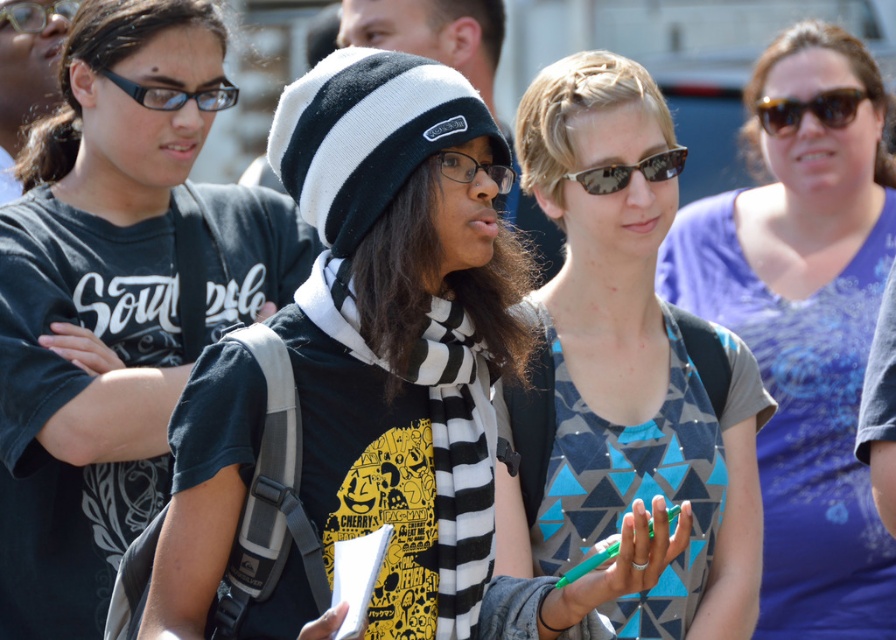
Which of these two, geometric-patterned shirt at center or clear plastic goggles at upper left, stands shorter?

clear plastic goggles at upper left is shorter.

Based on the photo, can you confirm if geometric-patterned shirt at center is shorter than clear plastic goggles at upper left?

No, geometric-patterned shirt at center is not shorter than clear plastic goggles at upper left.

Measure the distance between point [629,200] and camera.

Point [629,200] is 6.16 meters from camera.

Identify the location of geometric-patterned shirt at center. (627, 371).

Between matte black t-shirt at center and clear plastic goggles at upper left, which one has more height?

matte black t-shirt at center

Between point (116, 224) and point (48, 12), which one is positioned behind?

Positioned behind is point (48, 12).

Image resolution: width=896 pixels, height=640 pixels. I want to click on matte black t-shirt at center, so click(x=95, y=308).

Does camouflage-patterned sunglasses at center appear on the right side of clear plastic goggles at upper left?

Indeed, camouflage-patterned sunglasses at center is positioned on the right side of clear plastic goggles at upper left.

Can you confirm if camouflage-patterned sunglasses at center is positioned below clear plastic goggles at upper left?

Yes.

Does point (653, 170) lie in front of point (50, 13)?

Yes, point (653, 170) is closer to viewer.

At what (x,y) coordinates should I click in order to perform the action: click on camouflage-patterned sunglasses at center. Please return your answer as a coordinate pair (x, y). The width and height of the screenshot is (896, 640). Looking at the image, I should click on (630, 172).